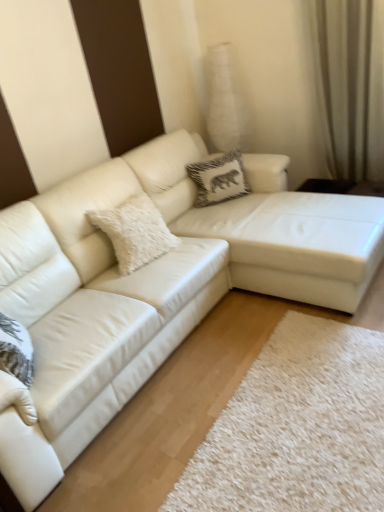
Describe the element at coordinates (135, 232) in the screenshot. I see `white fluffy pillow at center, placed as the first pillow when sorted from left to right` at that location.

You are a GUI agent. You are given a task and a screenshot of the screen. Output one action in this format:
    pyautogui.click(x=<x>, y=<y>)
    Task: Click on the beige fabric curtain at upper right
    
    Given the screenshot: What is the action you would take?
    pyautogui.click(x=350, y=84)

Image resolution: width=384 pixels, height=512 pixels. Describe the element at coordinates (219, 179) in the screenshot. I see `white textured pillow at center, the 1th pillow in the right-to-left sequence` at that location.

The height and width of the screenshot is (512, 384). What do you see at coordinates (270, 225) in the screenshot?
I see `white leather couch at center` at bounding box center [270, 225].

Where is `white fluffy pillow at center, which appears as the 2th pillow when viewed from the right`? white fluffy pillow at center, which appears as the 2th pillow when viewed from the right is located at coordinates (135, 232).

Considering the positions of point (190, 201) and point (319, 44), is point (190, 201) closer or farther from the camera than point (319, 44)?

Point (190, 201) is positioned farther from the camera compared to point (319, 44).

Which of these two, white leather couch at center or beige fabric curtain at upper right, stands taller?

With more height is beige fabric curtain at upper right.

Does white leather couch at center have a larger size compared to beige fabric curtain at upper right?

Indeed, white leather couch at center has a larger size compared to beige fabric curtain at upper right.

The width and height of the screenshot is (384, 512). Find the location of `couch that is on the left side of beige fabric curtain at upper right`. couch that is on the left side of beige fabric curtain at upper right is located at coordinates (270, 225).

In terms of size, does white fluffy pillow at center, which is the 1th pillow from bottom to top, appear bigger or smaller than white leather couch at center?

Clearly, white fluffy pillow at center, which is the 1th pillow from bottom to top, is smaller in size than white leather couch at center.

Which is more distant, (152,233) or (298,255)?

Point (152,233)

Considering the sizes of objects white fluffy pillow at center, which is the 1th pillow from front to back, and white leather couch at center in the image provided, who is taller, white fluffy pillow at center, which is the 1th pillow from front to back, or white leather couch at center?

With more height is white leather couch at center.

From the image's perspective, is white fluffy pillow at center, placed as the first pillow when sorted from left to right, positioned above or below white leather couch at center?

white fluffy pillow at center, placed as the first pillow when sorted from left to right, is situated lower than white leather couch at center in the image.

From the image's perspective, is white textured pillow at center, the 2th pillow in the bottom-to-top sequence, above or below white leather couch at center?

white textured pillow at center, the 2th pillow in the bottom-to-top sequence, is situated higher than white leather couch at center in the image.

Looking at the image, does white textured pillow at center, the 1th pillow in the right-to-left sequence, seem bigger or smaller compared to white leather couch at center?

In the image, white textured pillow at center, the 1th pillow in the right-to-left sequence, appears to be smaller than white leather couch at center.

Which pillow is the 2nd one when counting from the back of the white leather couch at center? Please provide its 2D coordinates.

[(219, 179)]

Considering the sizes of white textured pillow at center, the 2th pillow from the front, and white leather couch at center in the image, is white textured pillow at center, the 2th pillow from the front, taller or shorter than white leather couch at center?

In the image, white textured pillow at center, the 2th pillow from the front, appears to be shorter than white leather couch at center.

Is beige fabric curtain at upper right looking in the opposite direction of white fluffy pillow at center, which is counted as the 2th pillow, starting from the top?

No, beige fabric curtain at upper right is not facing away from white fluffy pillow at center, which is counted as the 2th pillow, starting from the top.

Considering the sizes of beige fabric curtain at upper right and white fluffy pillow at center, which ranks as the second pillow in back-to-front order, in the image, is beige fabric curtain at upper right wider or thinner than white fluffy pillow at center, which ranks as the second pillow in back-to-front order,?

In the image, beige fabric curtain at upper right appears to be more narrow than white fluffy pillow at center, which ranks as the second pillow in back-to-front order.

From a real-world perspective, which object stands above the other?

Answer: beige fabric curtain at upper right is physically above.

Find the location of `the 2nd pillow located above the white leather couch at center (from a real-world perspective)`. the 2nd pillow located above the white leather couch at center (from a real-world perspective) is located at coordinates (135, 232).

Is white fluffy pillow at center, which is counted as the 2th pillow, starting from the top, a part of white leather couch at center?

No.

In the scene shown: Is white leather couch at center touching white fluffy pillow at center, placed as the first pillow when sorted from left to right?

No, white leather couch at center is not making contact with white fluffy pillow at center, placed as the first pillow when sorted from left to right.

Is white textured pillow at center, arranged as the 1th pillow when viewed from the back, far from beige fabric curtain at upper right?

They are positioned close to each other.

Looking at this image, could you measure the distance between white textured pillow at center, arranged as the 1th pillow when viewed from the back, and beige fabric curtain at upper right?

white textured pillow at center, arranged as the 1th pillow when viewed from the back, and beige fabric curtain at upper right are 34.29 inches apart.

Does point (218, 182) come closer to viewer compared to point (370, 20)?

No.

Is white textured pillow at center, placed as the first pillow when sorted from top to bottom, bigger than beige fabric curtain at upper right?

No, white textured pillow at center, placed as the first pillow when sorted from top to bottom, is not bigger than beige fabric curtain at upper right.

Considering the positions of objects white fluffy pillow at center, which appears as the 2th pillow when viewed from the right, and beige fabric curtain at upper right in the image provided, who is more to the left, white fluffy pillow at center, which appears as the 2th pillow when viewed from the right, or beige fabric curtain at upper right?

white fluffy pillow at center, which appears as the 2th pillow when viewed from the right, is more to the left.

Can beige fabric curtain at upper right be found inside white fluffy pillow at center, which appears as the 2th pillow when viewed from the right?

That's incorrect, beige fabric curtain at upper right is not inside white fluffy pillow at center, which appears as the 2th pillow when viewed from the right.

Is white fluffy pillow at center, placed as the first pillow when sorted from left to right, directly adjacent to beige fabric curtain at upper right?

No, white fluffy pillow at center, placed as the first pillow when sorted from left to right, is not touching beige fabric curtain at upper right.

Based on the photo, is white fluffy pillow at center, which is the 1th pillow from front to back, closer to the viewer compared to beige fabric curtain at upper right?

Yes, the depth of white fluffy pillow at center, which is the 1th pillow from front to back, is less than that of beige fabric curtain at upper right.

Locate an element on the screen. curtain on the right of white leather couch at center is located at coordinates click(x=350, y=84).

Find the location of a particular element. couch below the white fluffy pillow at center, which is the 1th pillow from front to back (from a real-world perspective) is located at coordinates (270, 225).

Which object lies nearer to the anchor point white fluffy pillow at center, which is the 1th pillow from front to back, white textured pillow at center, arranged as the 1th pillow when viewed from the back, or beige fabric curtain at upper right?

white textured pillow at center, arranged as the 1th pillow when viewed from the back, lies closer to white fluffy pillow at center, which is the 1th pillow from front to back, than the other object.

From the image, which object appears to be nearer to beige fabric curtain at upper right, white leather couch at center or white fluffy pillow at center, which appears as the 2th pillow when viewed from the right?

white leather couch at center is positioned closer to the anchor beige fabric curtain at upper right.

From the image, which object appears to be nearer to white fluffy pillow at center, which appears as the 2th pillow when viewed from the right, white textured pillow at center, arranged as the 1th pillow when viewed from the back, or white leather couch at center?

The object closer to white fluffy pillow at center, which appears as the 2th pillow when viewed from the right, is white leather couch at center.

Looking at the image, which one is located closer to white fluffy pillow at center, which is the 1th pillow from bottom to top, white leather couch at center or beige fabric curtain at upper right?

white leather couch at center is closer to white fluffy pillow at center, which is the 1th pillow from bottom to top.

From the picture: Estimate the real-world distances between objects in this image. Which object is further from white fluffy pillow at center, placed as the first pillow when sorted from left to right, white leather couch at center or white textured pillow at center, the 2th pillow from the front?

The object further to white fluffy pillow at center, placed as the first pillow when sorted from left to right, is white textured pillow at center, the 2th pillow from the front.

Based on the photo, from the image, which object appears to be nearer to beige fabric curtain at upper right, white textured pillow at center, the 2th pillow from the front, or white leather couch at center?

white leather couch at center.

Considering their positions, is beige fabric curtain at upper right positioned closer to white leather couch at center than white textured pillow at center, arranged as the 2th pillow when viewed from the left?

white textured pillow at center, arranged as the 2th pillow when viewed from the left.

When comparing their distances from beige fabric curtain at upper right, does white fluffy pillow at center, which is counted as the 2th pillow, starting from the top, or white leather couch at center seem further?

white fluffy pillow at center, which is counted as the 2th pillow, starting from the top.

Identify the location of couch between white fluffy pillow at center, which appears as the 2th pillow when viewed from the right, and beige fabric curtain at upper right from left to right. (270, 225).

Locate an element on the screen. The height and width of the screenshot is (512, 384). curtain positioned between white leather couch at center and white textured pillow at center, placed as the first pillow when sorted from top to bottom, from near to far is located at coordinates (350, 84).

The width and height of the screenshot is (384, 512). In order to click on pillow situated between white fluffy pillow at center, which is counted as the 2th pillow, starting from the top, and beige fabric curtain at upper right from left to right in this screenshot , I will do pos(219,179).

Locate an element on the screen. Image resolution: width=384 pixels, height=512 pixels. pillow located between white leather couch at center and white textured pillow at center, the 2th pillow in the bottom-to-top sequence, in the depth direction is located at coordinates (135, 232).